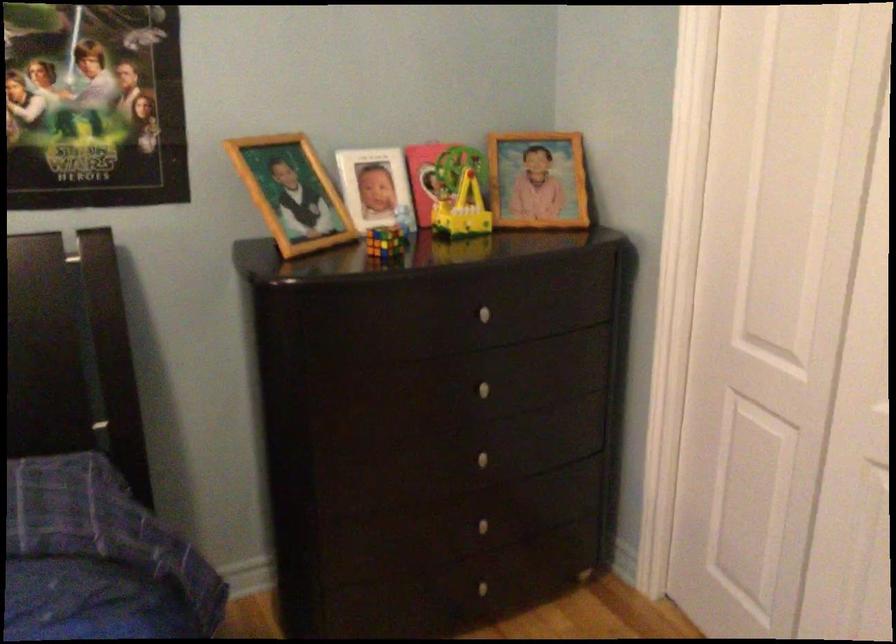
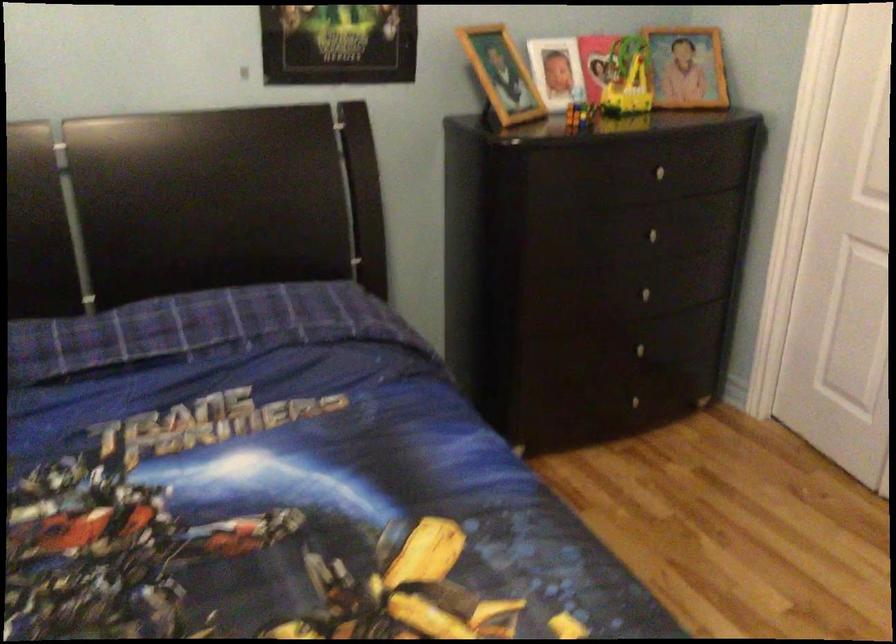
What movement of the cameraman would produce the second image?

The cameraman walked toward left, backward.